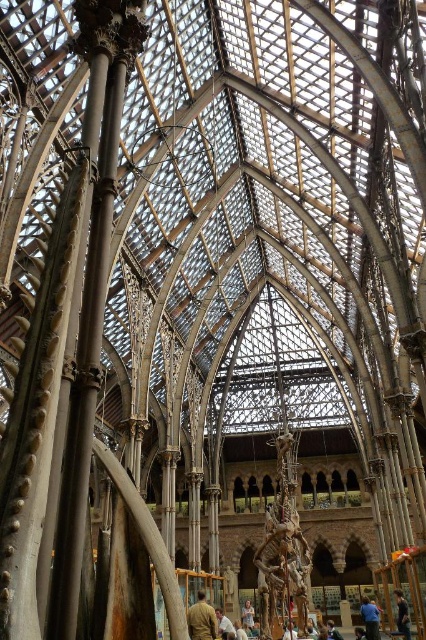
Does light brown leather jacket at lower center have a larger size compared to dark blue jeans at lower right?

Yes, light brown leather jacket at lower center is bigger than dark blue jeans at lower right.

Measure the distance between light brown leather jacket at lower center and camera.

light brown leather jacket at lower center is 248.06 feet from camera.

You are a GUI agent. You are given a task and a screenshot of the screen. Output one action in this format:
    pyautogui.click(x=<x>, y=<y>)
    Task: Click on the light brown leather jacket at lower center
    The width and height of the screenshot is (426, 640).
    Given the screenshot: What is the action you would take?
    [x=201, y=620]

Is dark blue jeans at lower right thinner than light brown wooden chair at center?

Yes.

Measure the distance between point (402, 602) and camera.

Point (402, 602) is 85.33 meters away from camera.

Measure the distance between point (406, 611) and camera.

Point (406, 611) is 84.25 meters from camera.

Locate an element on the screen. dark blue jeans at lower right is located at coordinates (402, 614).

Does brown wooden dinosaur at center have a larger size compared to blue fabric shirt at lower right?

Correct, brown wooden dinosaur at center is larger in size than blue fabric shirt at lower right.

How far apart are brown wooden dinosaur at center and blue fabric shirt at lower right?

They are 20.94 meters apart.

You are a GUI agent. You are given a task and a screenshot of the screen. Output one action in this format:
    pyautogui.click(x=<x>, y=<y>)
    Task: Click on the brown wooden dinosaur at center
    The height and width of the screenshot is (640, 426).
    Given the screenshot: What is the action you would take?
    pyautogui.click(x=282, y=547)